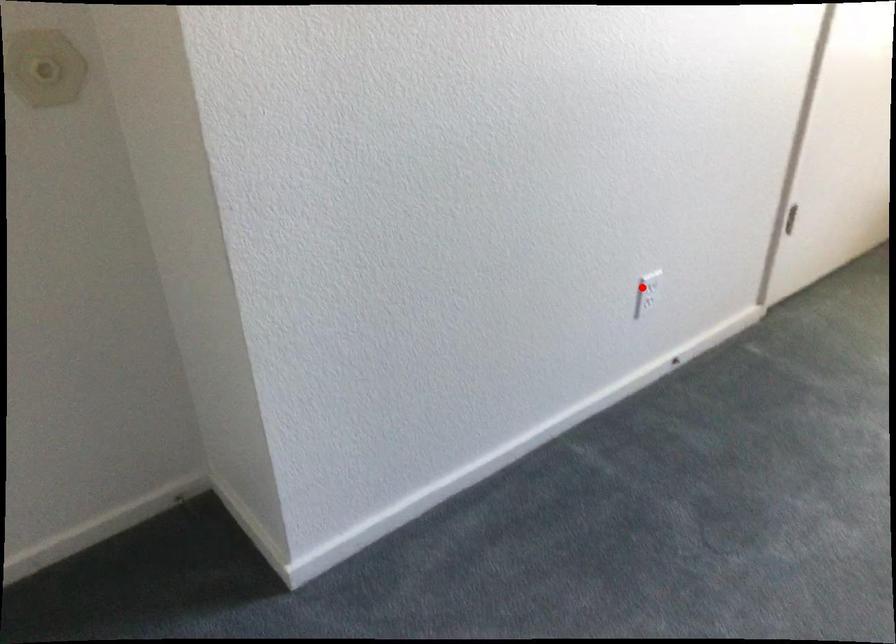
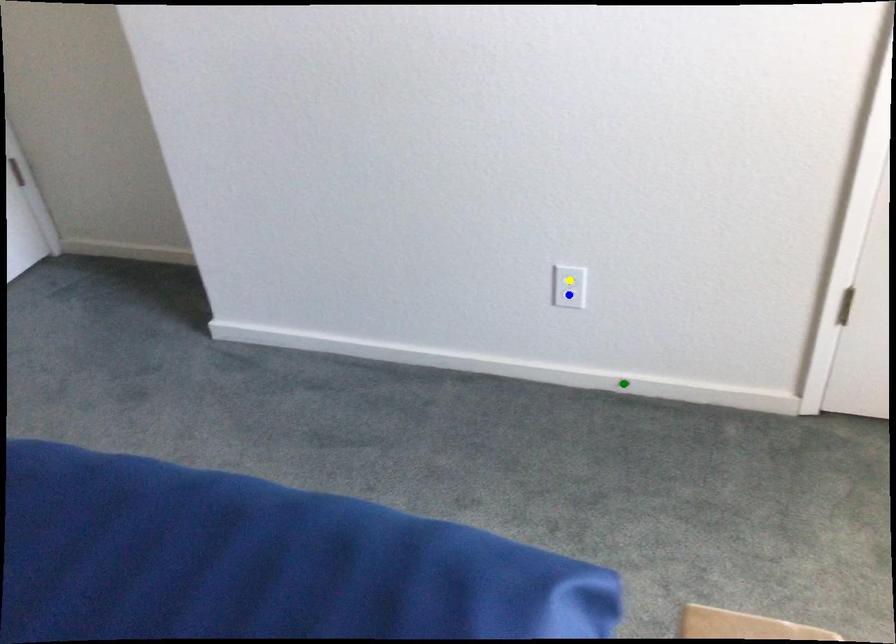
Question: I am providing you with two images of the same scene from different viewpoints. A red point is marked on the first image. You are given multiple points on the second image. Which mark in image 2 goes with the point in image 1?

Choices:
 (A) green point
 (B) blue point
 (C) yellow point

Answer: (C)